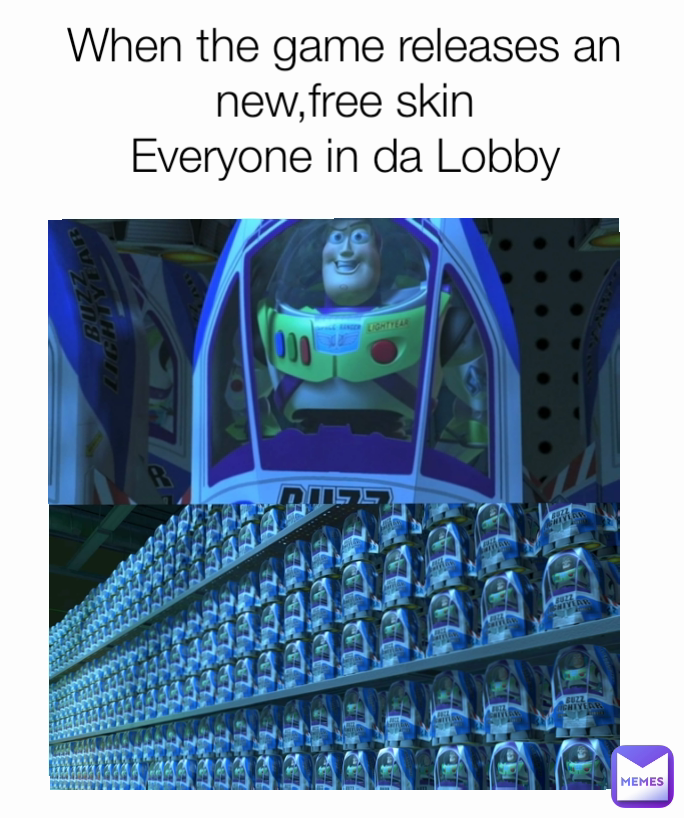
Locate an element on the screen. The image size is (684, 818). space below pictures is located at coordinates (328, 811).